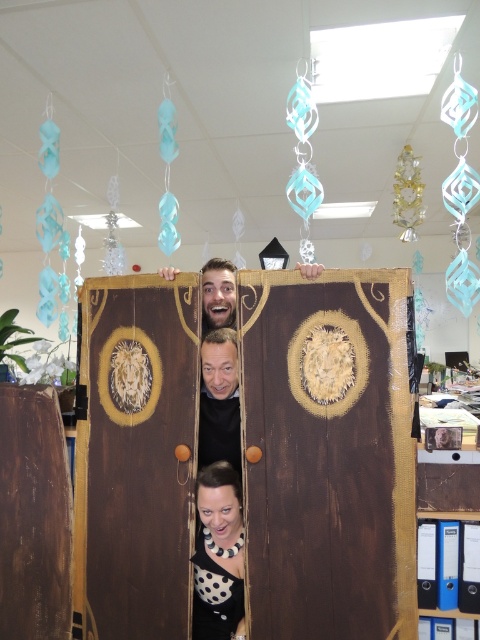
Question: Is polka dot blouse at lower center smaller than wooden door at center?

Choices:
 (A) no
 (B) yes

Answer: (B)

Question: Which object is farther from the camera taking this photo?

Choices:
 (A) wooden door at center
 (B) polka dot blouse at lower center
 (C) smooth brown wooden door at center

Answer: (C)

Question: Does polka dot blouse at lower center have a greater width compared to wooden door at center?

Choices:
 (A) yes
 (B) no

Answer: (B)

Question: Among these points, which one is nearest to the camera?

Choices:
 (A) (196, 492)
 (B) (231, 269)

Answer: (A)

Question: Which object is farther from the camera taking this photo?

Choices:
 (A) smooth brown wooden door at center
 (B) polka dot blouse at lower center
 (C) wooden door at center

Answer: (A)

Question: Does polka dot blouse at lower center have a greater width compared to wooden door at center?

Choices:
 (A) yes
 (B) no

Answer: (B)